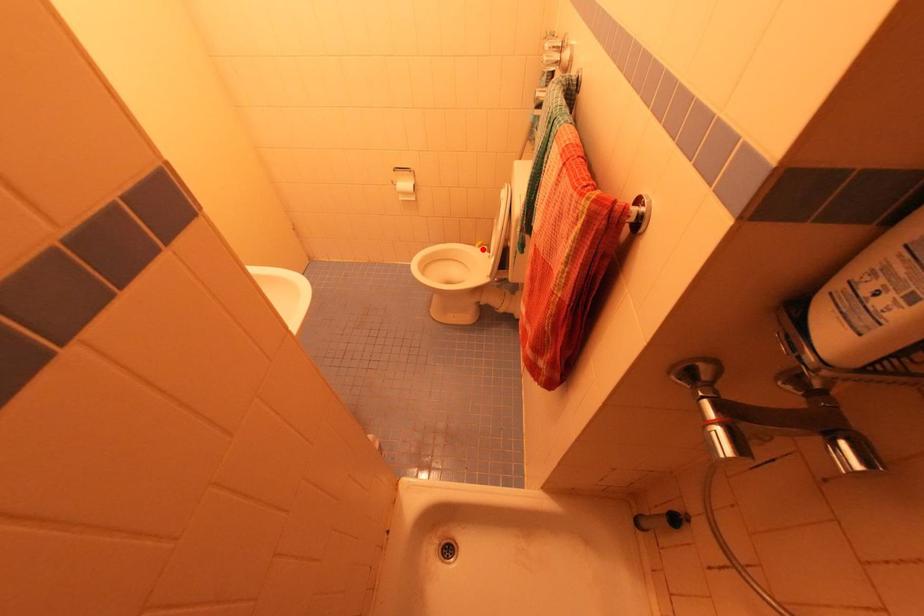
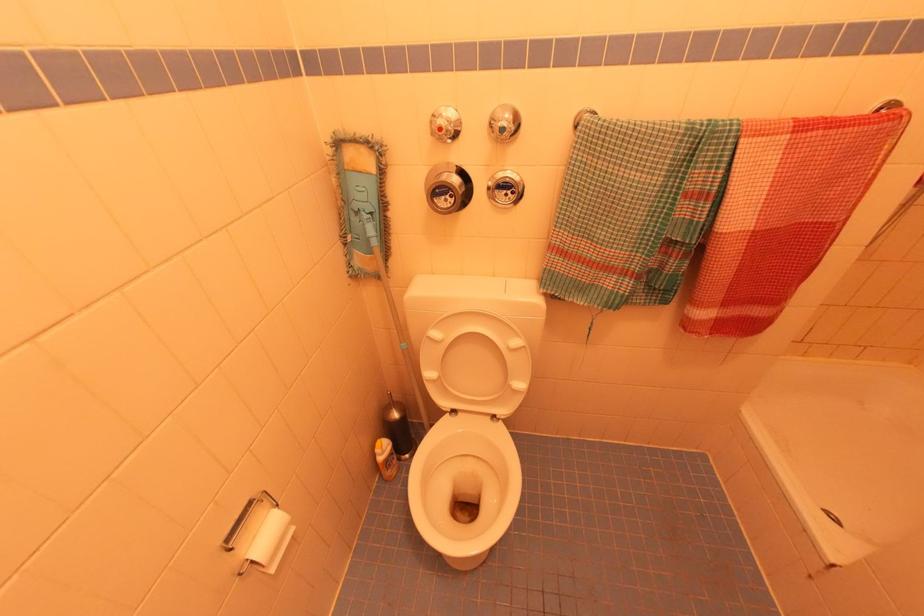
Question: I am providing you with two images of the same scene from different viewpoints. Given a red point in image1, look at the same physical point in image2. Is it:

Choices:
 (A) Closer to the viewpoint
 (B) Farther from the viewpoint

Answer: (A)